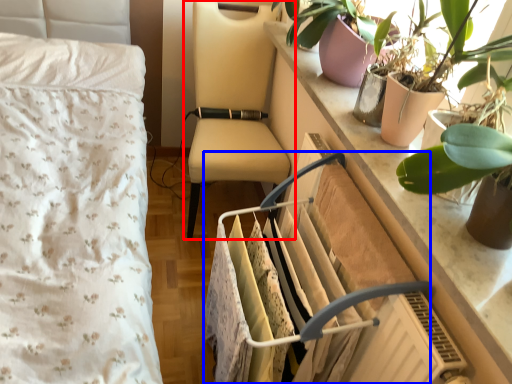
Question: Which object is further to the camera taking this photo, chair (highlighted by a red box) or closet (highlighted by a blue box)?

Choices:
 (A) chair
 (B) closet

Answer: (A)